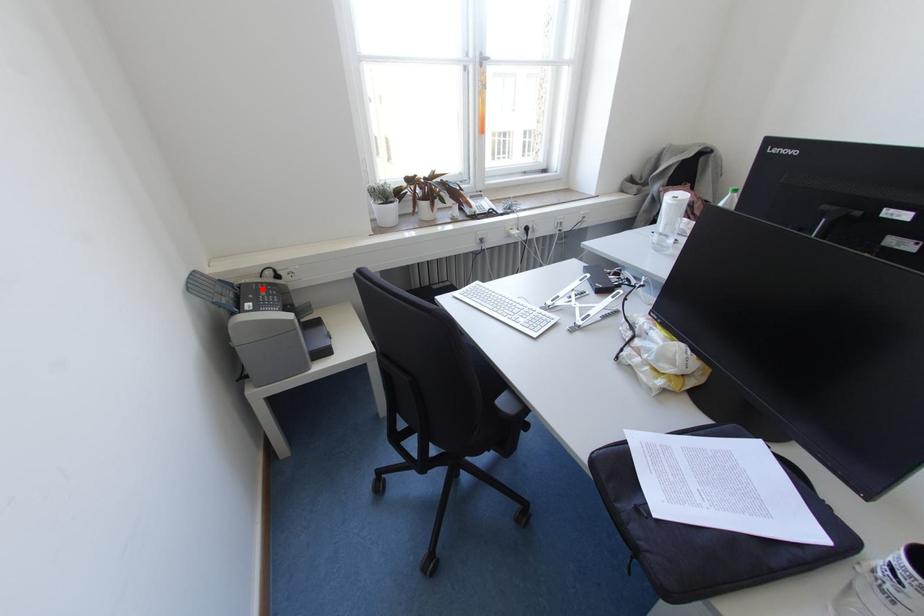
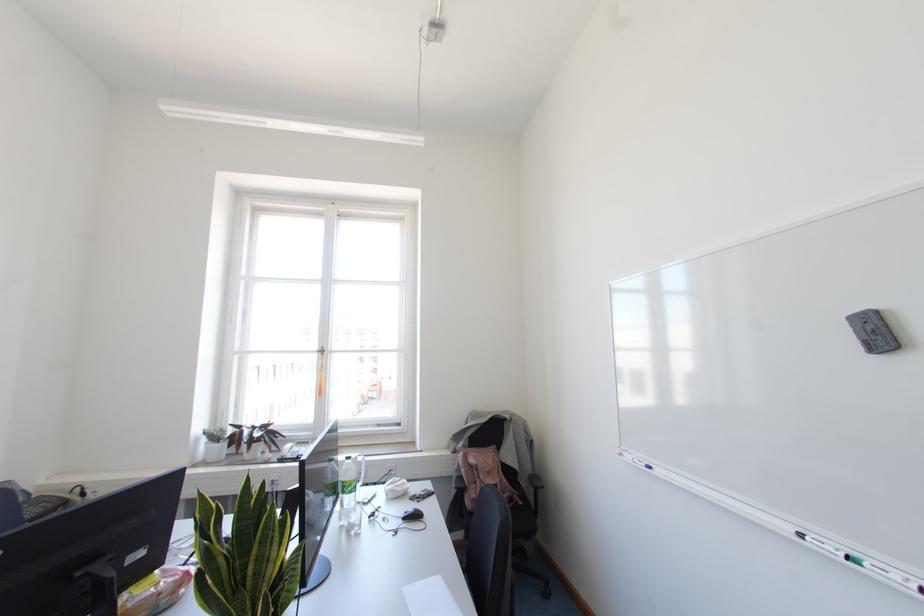
The point at the highlighted location is marked in the first image. Where is the corresponding point in the second image?

(46, 501)